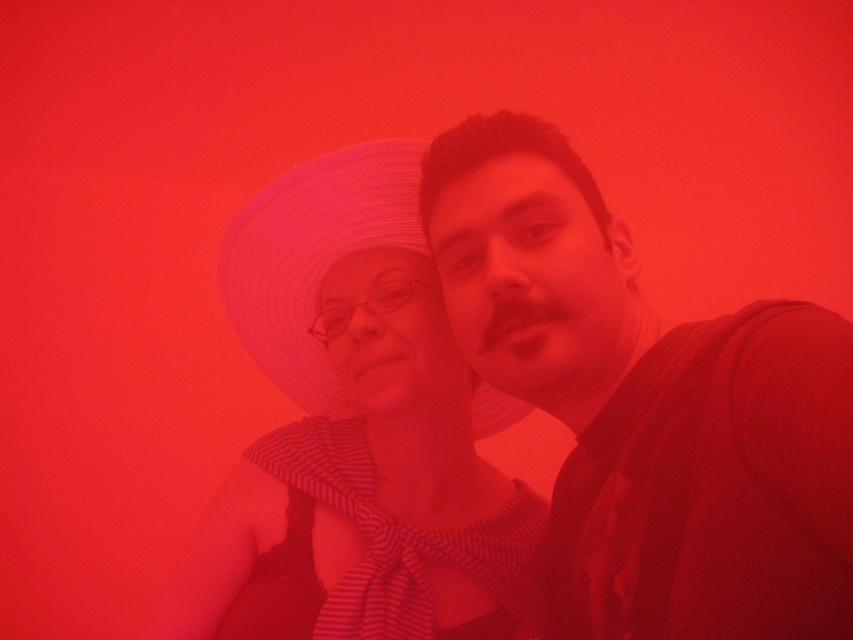
Can you confirm if matte black shirt at center is positioned above matte white hat at center?

Indeed, matte black shirt at center is positioned over matte white hat at center.

This screenshot has height=640, width=853. Describe the element at coordinates (647, 406) in the screenshot. I see `matte black shirt at center` at that location.

This screenshot has width=853, height=640. Find the location of `matte black shirt at center`. matte black shirt at center is located at coordinates (647, 406).

Is matte white hat at center bigger than white straw hat at center?

Incorrect, matte white hat at center is not larger than white straw hat at center.

Is matte white hat at center above white straw hat at center?

Actually, matte white hat at center is below white straw hat at center.

Does point (419, 275) lie in front of point (262, 294)?

Yes, it is in front of point (262, 294).

Where is `matte white hat at center`? matte white hat at center is located at coordinates (375, 468).

Does point (703, 612) come behind point (479, 396)?

That is False.

Does matte black shirt at center have a smaller size compared to white straw hat at center?

Incorrect, matte black shirt at center is not smaller in size than white straw hat at center.

Which is behind, point (569, 604) or point (383, 236)?

The point (383, 236) is behind.

Locate an element on the screen. The image size is (853, 640). matte black shirt at center is located at coordinates (647, 406).